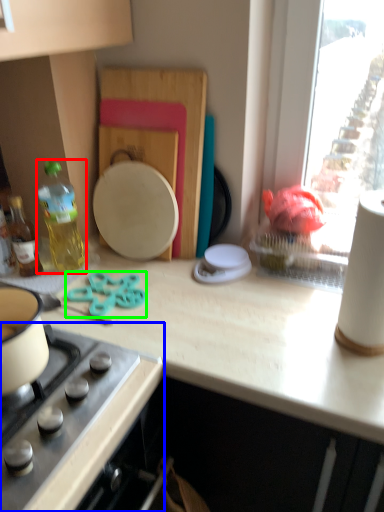
Question: Which is nearer to the bottle (highlighted by a red box)? gas stove (highlighted by a blue box) or scissors (highlighted by a green box).

Choices:
 (A) gas stove
 (B) scissors

Answer: (B)